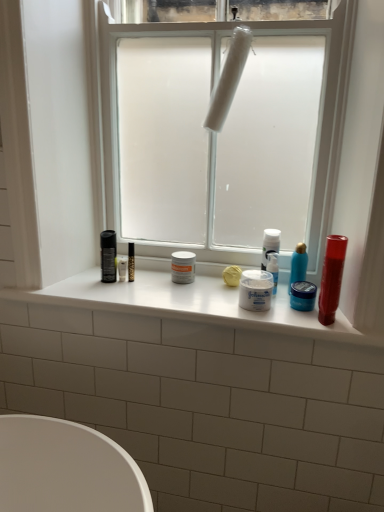
This screenshot has width=384, height=512. I want to click on vacant area in front of white matte jar at center, which appears as the 2th toiletry when viewed from the left, so click(273, 316).